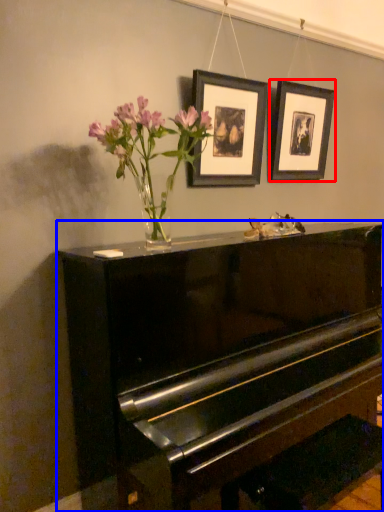
Question: Which object is closer to the camera taking this photo, picture frame (highlighted by a red box) or piano (highlighted by a blue box)?

Choices:
 (A) picture frame
 (B) piano

Answer: (B)